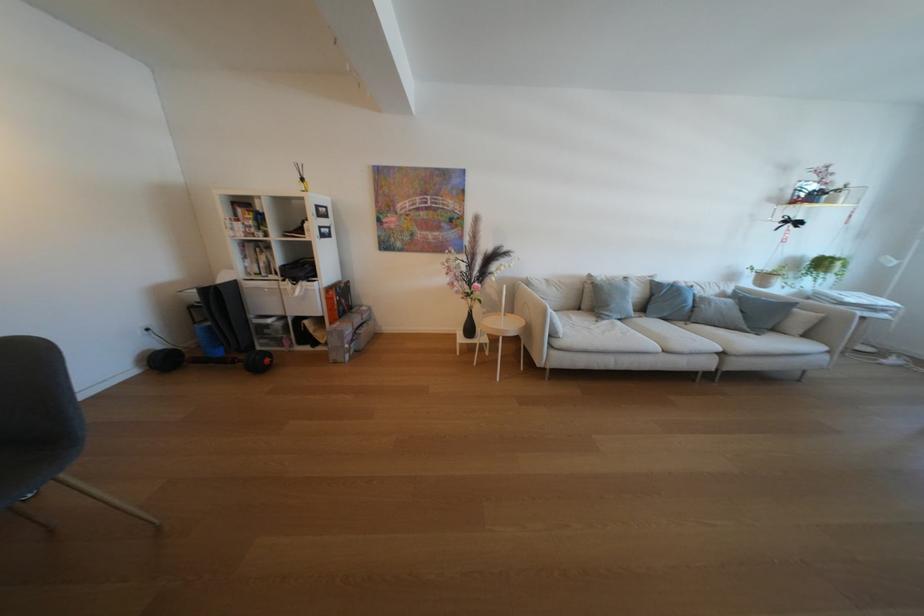
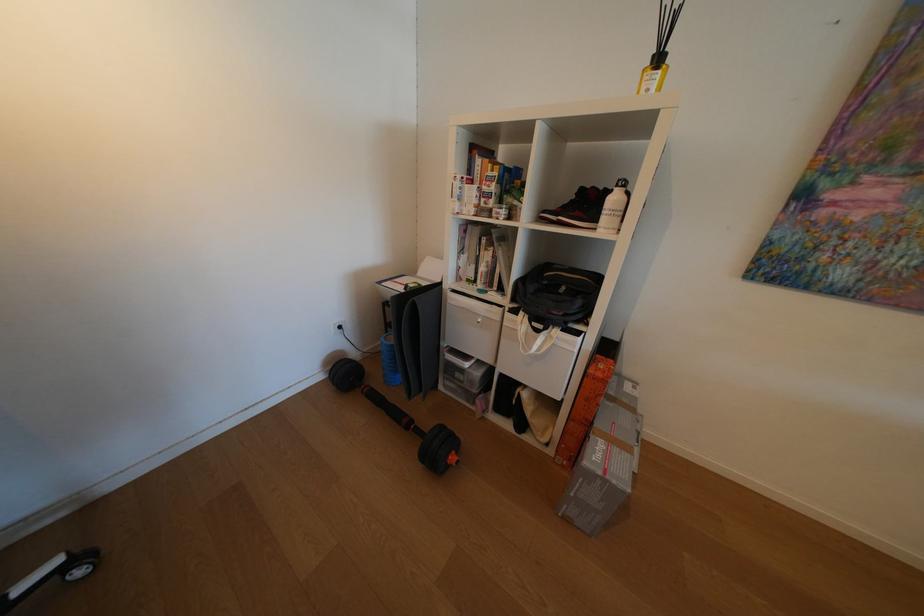
Locate, in the second image, the point that corresponds to (x=315, y=235) in the first image.

(608, 222)